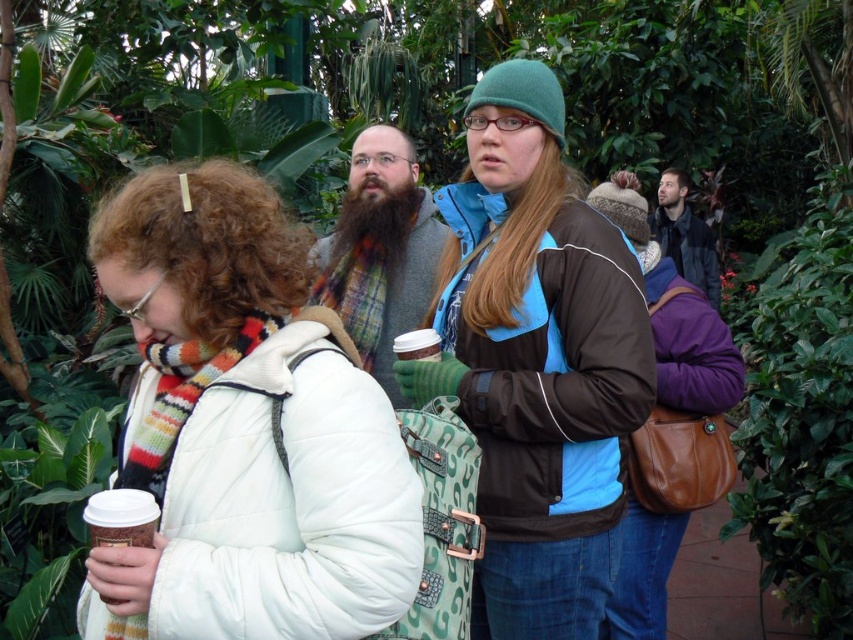
Is point (598, 349) more distant than point (132, 621)?

Yes, point (598, 349) is farther from viewer.

Does brown/blue quilted jacket at center appear on the left side of white paper cup at lower left?

No, brown/blue quilted jacket at center is not to the left of white paper cup at lower left.

Between point (590, 627) and point (109, 504), which one is positioned in front?

Point (109, 504) is more forward.

I want to click on brown/blue quilted jacket at center, so click(537, 362).

Is the position of multicolored knitted scarf at left less distant than that of white paper cup at center?

That is True.

Can you confirm if multicolored knitted scarf at left is taller than white paper cup at center?

Yes, multicolored knitted scarf at left is taller than white paper cup at center.

At what (x,y) coordinates should I click in order to perform the action: click on multicolored knitted scarf at left. Please return your answer as a coordinate pair (x, y). Looking at the image, I should click on (215, 385).

Is point (201, 250) behind point (759, 388)?

No, (201, 250) is in front of (759, 388).

Does white puffy jacket at center appear on the left side of green leafy plant at right?

Correct, you'll find white puffy jacket at center to the left of green leafy plant at right.

Which is in front, point (175, 570) or point (799, 381)?

Point (175, 570) is more forward.

Locate an element on the screen. The width and height of the screenshot is (853, 640). white puffy jacket at center is located at coordinates (245, 428).